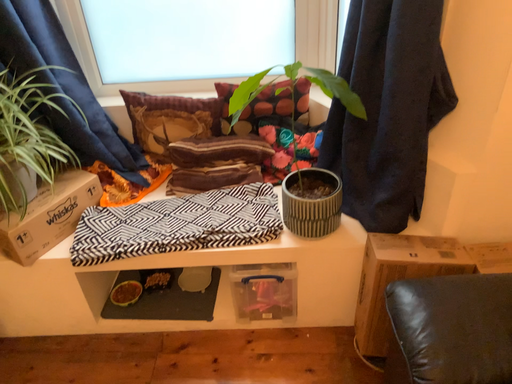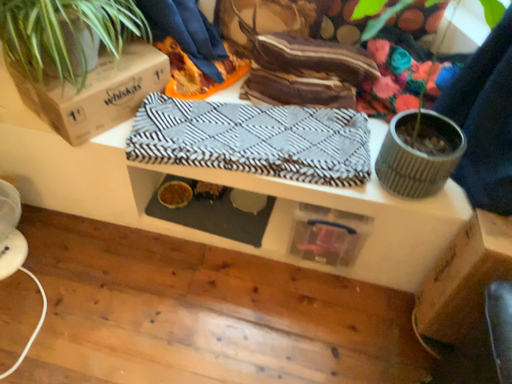
Question: Which way did the camera rotate in the video?

Choices:
 (A) rotated upward
 (B) rotated downward

Answer: (B)